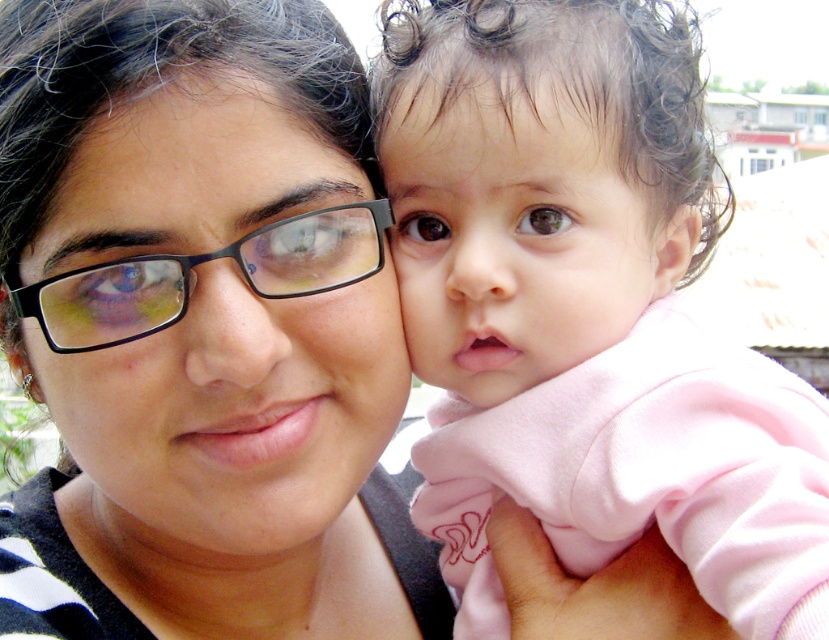
Who is shorter, smooth pink baby at center or black plastic glasses at center?

With less height is black plastic glasses at center.

Is smooth pink baby at center taller than black plastic glasses at center?

Yes.

This screenshot has width=829, height=640. Describe the element at coordinates (512, 237) in the screenshot. I see `smooth pink baby at center` at that location.

The height and width of the screenshot is (640, 829). I want to click on smooth pink baby at center, so click(512, 237).

How far apart are pink soft fabric at center and matte black glasses at center?

pink soft fabric at center and matte black glasses at center are 30.85 inches apart.

Can you confirm if pink soft fabric at center is thinner than matte black glasses at center?

Indeed, pink soft fabric at center has a lesser width compared to matte black glasses at center.

Which is in front, point (682, 540) or point (120, 348)?

Point (682, 540) is more forward.

The height and width of the screenshot is (640, 829). In order to click on pink soft fabric at center in this screenshot , I will do `click(585, 310)`.

This screenshot has height=640, width=829. What do you see at coordinates (585, 310) in the screenshot?
I see `pink soft fabric at center` at bounding box center [585, 310].

Is point (570, 145) positioned after point (469, 170)?

No, it is in front of (469, 170).

Where is `pink soft fabric at center`? Image resolution: width=829 pixels, height=640 pixels. pink soft fabric at center is located at coordinates [585, 310].

This screenshot has height=640, width=829. Find the location of `pink soft fabric at center`. pink soft fabric at center is located at coordinates (585, 310).